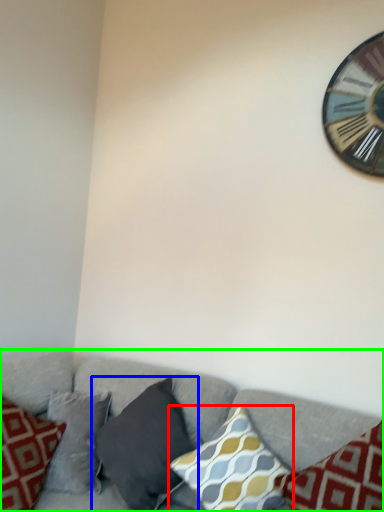
Question: Considering the real-world distances, which object is closest to pillow (highlighted by a red box)? pillow (highlighted by a blue box) or studio couch (highlighted by a green box).

Choices:
 (A) pillow
 (B) studio couch

Answer: (A)